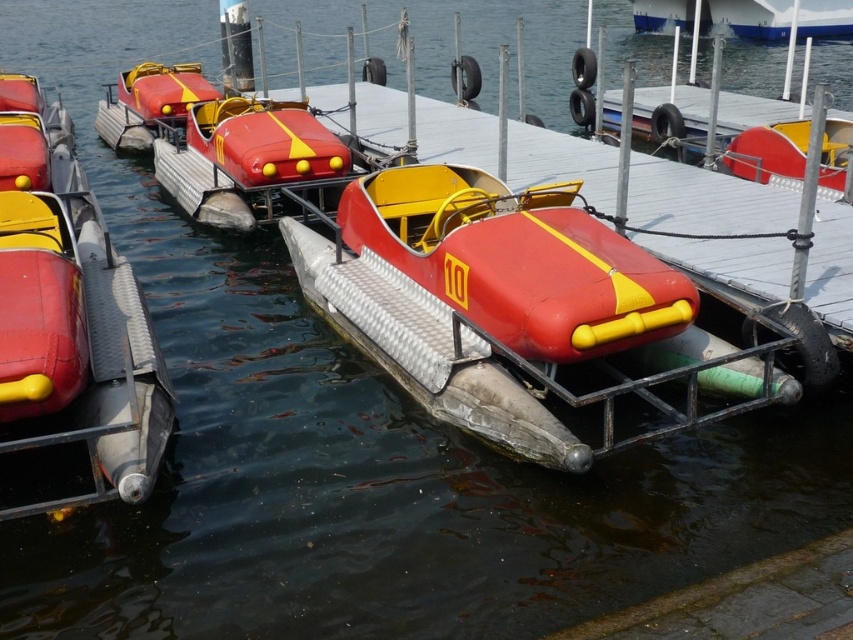
Does matte plastic boat at left have a greater width compared to metallic dock at center?

In fact, matte plastic boat at left might be narrower than metallic dock at center.

Which is more to the left, matte plastic boat at left or metallic dock at center?

Positioned to the left is matte plastic boat at left.

The width and height of the screenshot is (853, 640). Identify the location of matte plastic boat at left. (70, 314).

Can you confirm if matte plastic boat at left is thinner than matte plastic toy car at center?

No.

Is matte plastic boat at left in front of matte plastic toy car at center?

Yes, matte plastic boat at left is closer to the viewer.

Which is behind, point (44, 352) or point (595, 352)?

The point (595, 352) is behind.

Locate an element on the screen. The width and height of the screenshot is (853, 640). matte plastic boat at left is located at coordinates pyautogui.click(x=70, y=314).

Locate an element on the screen. matte plastic toy car at center is located at coordinates (517, 260).

The height and width of the screenshot is (640, 853). What do you see at coordinates (517, 260) in the screenshot?
I see `matte plastic toy car at center` at bounding box center [517, 260].

Is point (418, 273) closer to camera compared to point (695, 93)?

Yes.

Image resolution: width=853 pixels, height=640 pixels. In order to click on matte plastic toy car at center in this screenshot , I will do `click(517, 260)`.